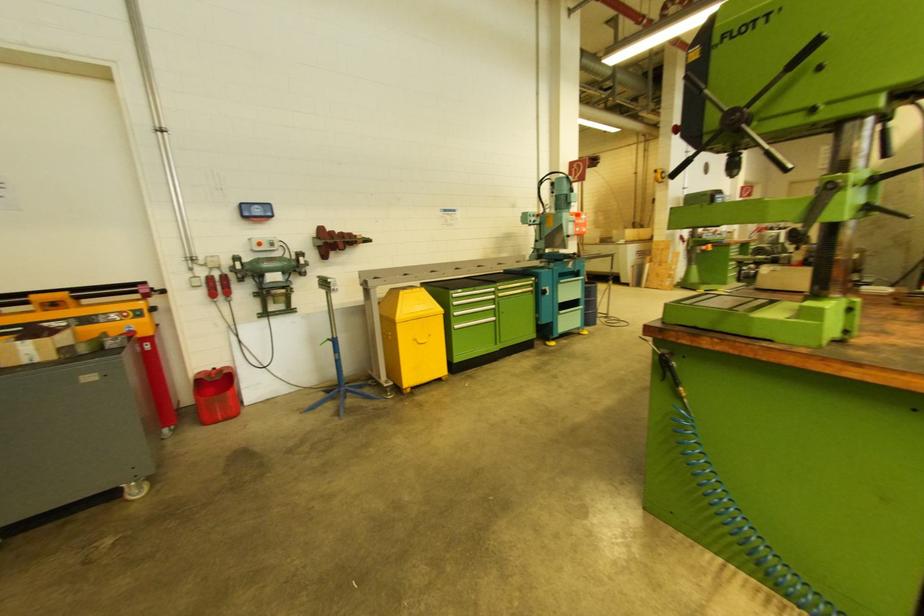
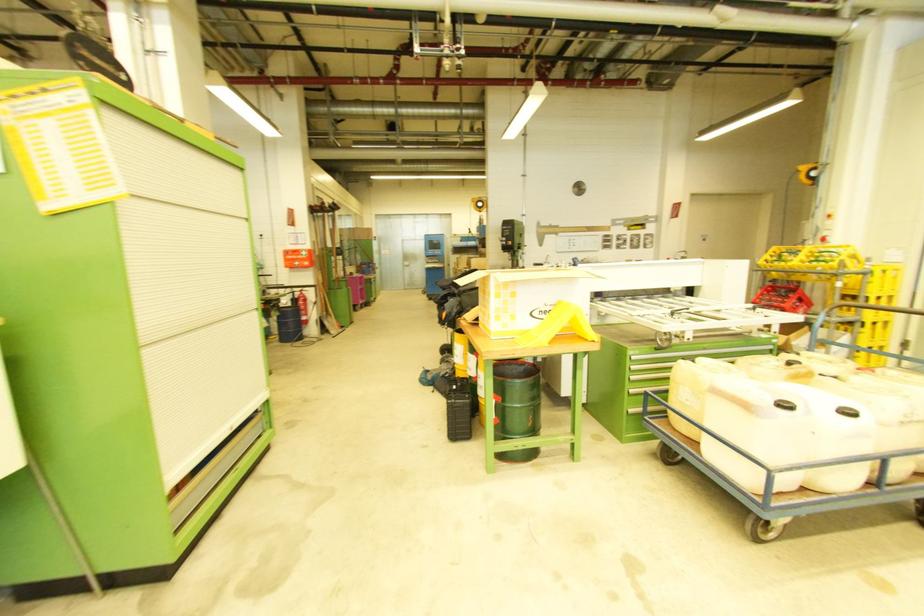
Where in the second image is the point corresponding to point 579,231 from the first image?

(299, 265)